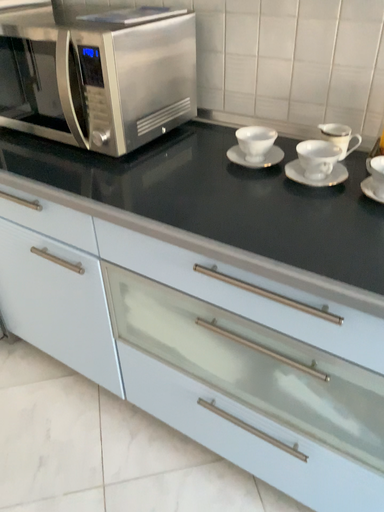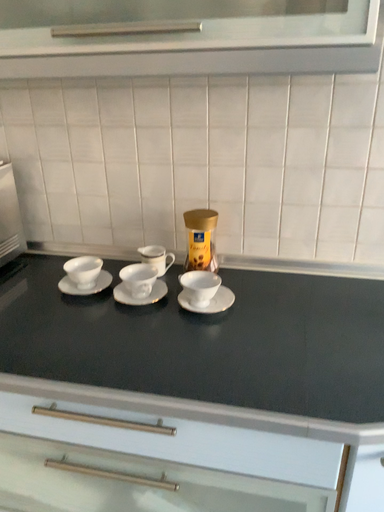
Question: How did the camera likely rotate when shooting the video?

Choices:
 (A) rotated left
 (B) rotated right

Answer: (B)